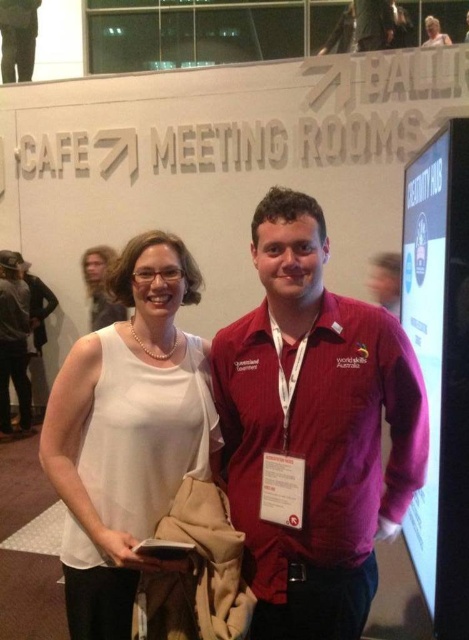
Question: Does matte red jacket at center appear on the left side of white matte tank top at center?

Choices:
 (A) no
 (B) yes

Answer: (A)

Question: Which object is farther from the camera taking this photo?

Choices:
 (A) white matte tank top at center
 (B) matte black hair at upper left

Answer: (B)

Question: Estimate the real-world distances between objects in this image. Which object is farther from the matte black hair at upper left?

Choices:
 (A) matte red jacket at center
 (B) white matte tank top at center

Answer: (A)

Question: Considering the relative positions of matte red jacket at center and white matte tank top at center in the image provided, where is matte red jacket at center located with respect to white matte tank top at center?

Choices:
 (A) right
 (B) left

Answer: (A)

Question: Among these objects, which one is nearest to the camera?

Choices:
 (A) matte red jacket at center
 (B) matte black hair at upper left
 (C) white matte tank top at center

Answer: (A)

Question: Does white matte tank top at center have a larger size compared to matte black hair at upper left?

Choices:
 (A) yes
 (B) no

Answer: (B)